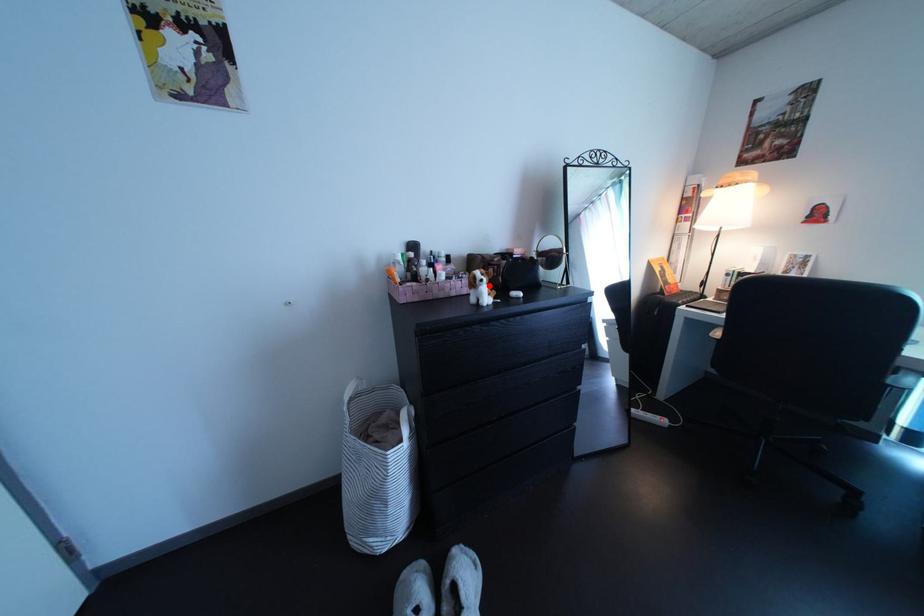
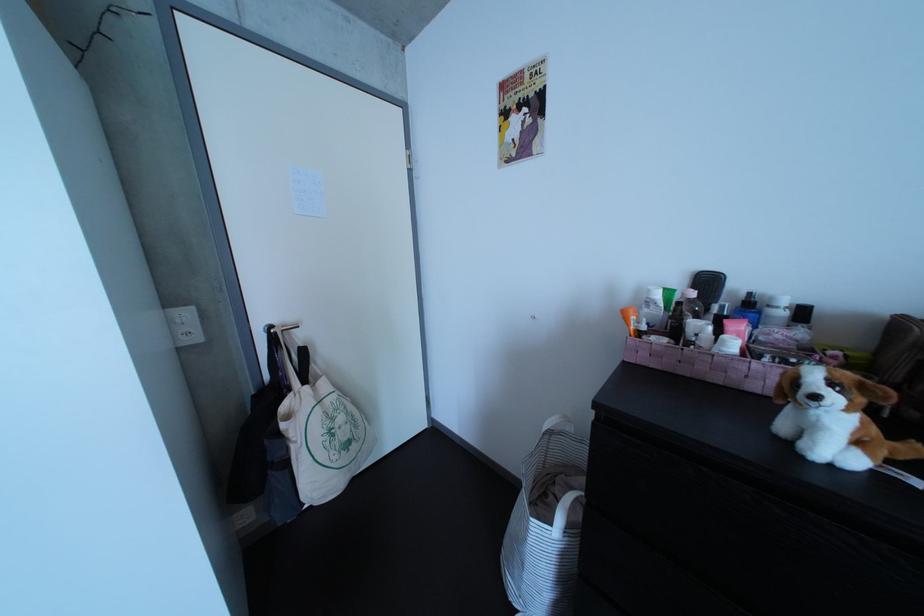
In the second image, find the point that corresponds to the highlighted location in the first image.

(809, 389)